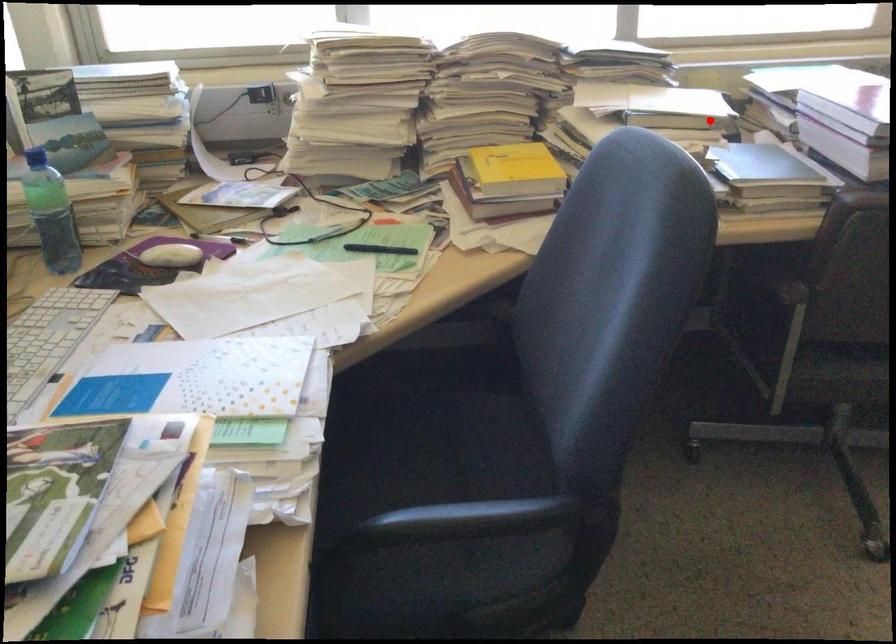
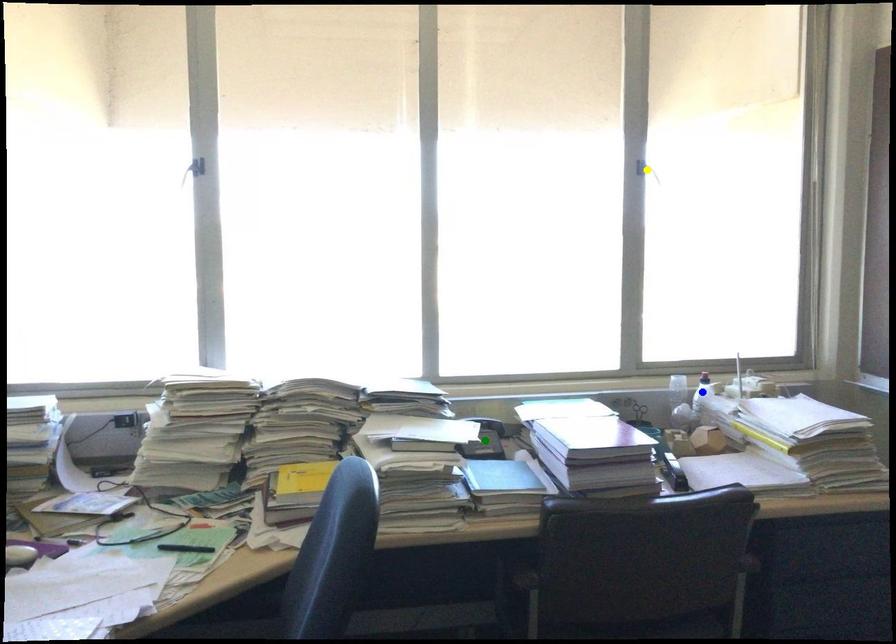
Question: I am providing you with two images of the same scene from different viewpoints. A red point is marked on the first image. You are given multiple points on the second image. Can you choose the point in image 2 that corresponds to the point in image 1?

Choices:
 (A) blue point
 (B) yellow point
 (C) green point

Answer: (C)